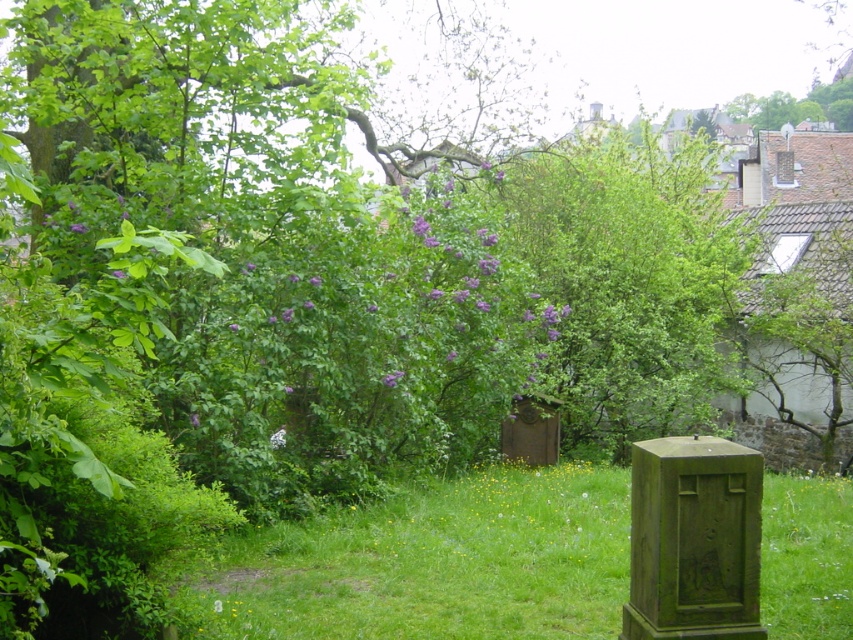
Does green leafy tree at center come behind smooth stone gravestone at center?

That is False.

Is point (689, 424) more distant than point (509, 445)?

That is True.

What are the coordinates of `green leafy tree at center` in the screenshot? It's located at (630, 282).

Locate an element on the screen. green leafy tree at center is located at coordinates (630, 282).

Is point (585, 563) positioned after point (637, 188)?

No, it is in front of (637, 188).

This screenshot has height=640, width=853. Identify the location of green grassy at center. (433, 563).

Who is more distant from viewer, (432,602) or (645,362)?

The point (645,362) is behind.

The width and height of the screenshot is (853, 640). Identify the location of green grassy at center. (433, 563).

Is green mossy gravestone at lower right positioned behind smooth stone gravestone at center?

No, green mossy gravestone at lower right is closer to the viewer.

Which is behind, point (733, 538) or point (552, 429)?

Positioned behind is point (552, 429).

The width and height of the screenshot is (853, 640). Identify the location of green mossy gravestone at lower right. (693, 540).

What are the coordinates of `green mossy gravestone at lower right` in the screenshot? It's located at (693, 540).